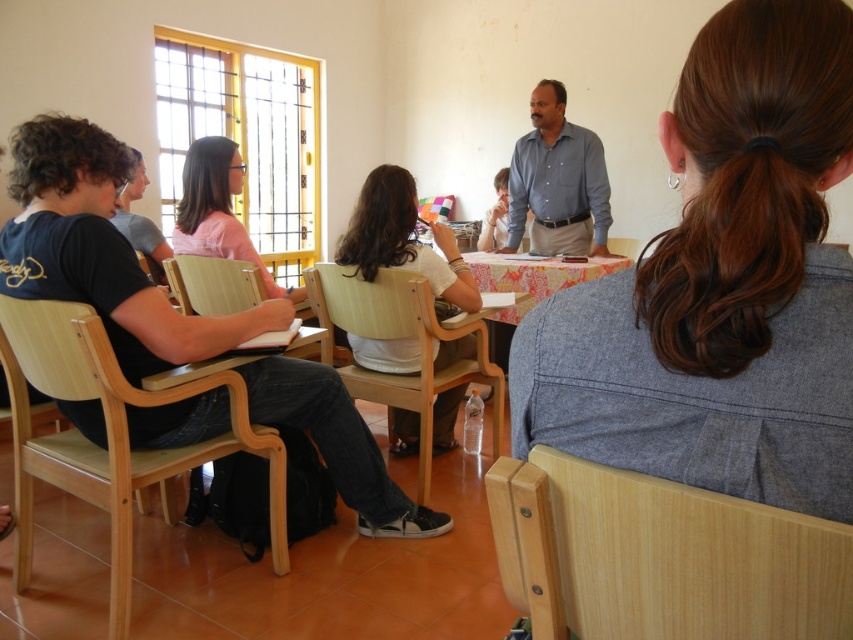
Question: Can you confirm if light wood chair at lower left is positioned to the right of pink matte shirt at center?

Choices:
 (A) yes
 (B) no

Answer: (B)

Question: Does white matte shirt at center appear over blue shirt at center?

Choices:
 (A) no
 (B) yes

Answer: (A)

Question: Which of these objects is positioned closest to the light wood chair at left?

Choices:
 (A) wooden chair at center
 (B) pink matte shirt at center

Answer: (B)

Question: Estimate the real-world distances between objects in this image. Which object is closer to the printed fabric table at center?

Choices:
 (A) light wood chair at left
 (B) pink matte shirt at center
 (C) blue shirt at center
 (D) wooden chair at center

Answer: (C)

Question: Which of the following is the farthest from the observer?

Choices:
 (A) (515, 160)
 (B) (445, 241)

Answer: (A)

Question: Is white matte shirt at center positioned in front of light wood chair at left?

Choices:
 (A) yes
 (B) no

Answer: (A)